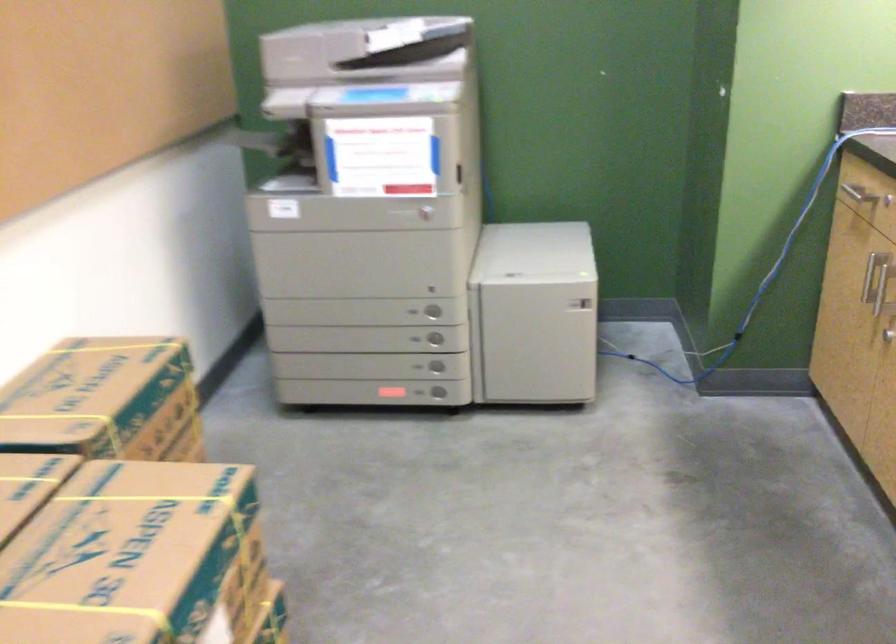
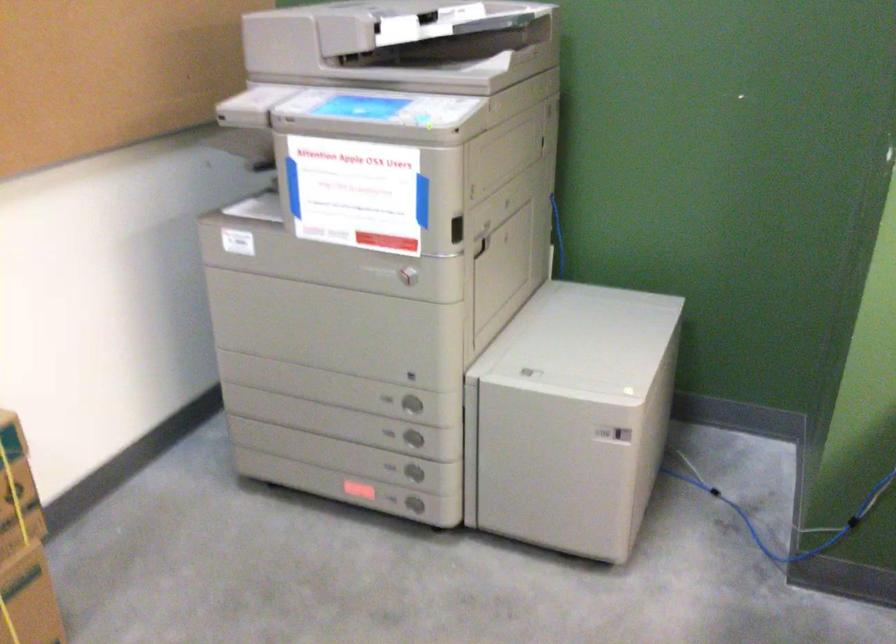
Locate, in the second image, the point that corresponds to [392,392] in the first image.

(358, 489)